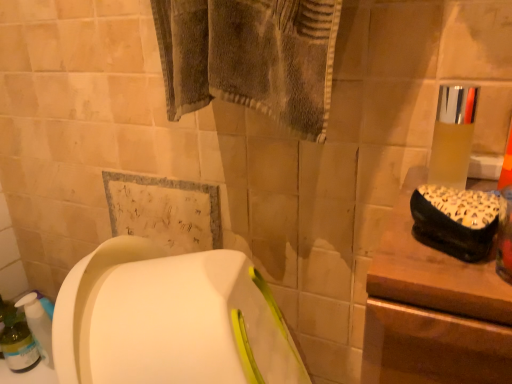
Find the location of a particular element. translucent plastic cup at upper right is located at coordinates (453, 135).

The image size is (512, 384). Describe the element at coordinates (453, 135) in the screenshot. I see `translucent plastic cup at upper right` at that location.

The width and height of the screenshot is (512, 384). I want to click on translucent plastic bottle at lower left, so click(17, 341).

The image size is (512, 384). Describe the element at coordinates (17, 341) in the screenshot. I see `translucent plastic bottle at lower left` at that location.

Identify the location of translucent plastic cup at upper right. This screenshot has height=384, width=512. (453, 135).

Which is more to the right, translucent plastic cup at upper right or translucent plastic bottle at lower left?

translucent plastic cup at upper right.

Which is behind, translucent plastic cup at upper right or translucent plastic bottle at lower left?

translucent plastic bottle at lower left is further from the camera.

Does point (440, 183) lie in front of point (18, 341)?

That is True.

From the image's perspective, does translucent plastic cup at upper right appear lower than translucent plastic bottle at lower left?

No.

From a real-world perspective, which is physically below, translucent plastic cup at upper right or translucent plastic bottle at lower left?

In real-world perspective, translucent plastic bottle at lower left is lower.

Between translucent plastic cup at upper right and translucent plastic bottle at lower left, which one has larger width?

translucent plastic bottle at lower left.

Between translucent plastic cup at upper right and translucent plastic bottle at lower left, which one has more height?

Standing taller between the two is translucent plastic bottle at lower left.

Considering the relative sizes of translucent plastic cup at upper right and translucent plastic bottle at lower left in the image provided, is translucent plastic cup at upper right bigger than translucent plastic bottle at lower left?

Incorrect, translucent plastic cup at upper right is not larger than translucent plastic bottle at lower left.

Would you say translucent plastic cup at upper right is outside translucent plastic bottle at lower left?

Yes, translucent plastic cup at upper right is located beyond the bounds of translucent plastic bottle at lower left.

Is translucent plastic cup at upper right far from translucent plastic bottle at lower left?

translucent plastic cup at upper right is positioned a significant distance from translucent plastic bottle at lower left.

Is translucent plastic cup at upper right turned away from translucent plastic bottle at lower left?

No.

What's the angular difference between translucent plastic cup at upper right and translucent plastic bottle at lower left's facing directions?

The angular difference between translucent plastic cup at upper right and translucent plastic bottle at lower left is 6.75 degrees.

You are a GUI agent. You are given a task and a screenshot of the screen. Output one action in this format:
    pyautogui.click(x=<x>, y=<y>)
    Task: Click on the bottle that is under the translucent plastic cup at upper right (from a real-world perspective)
    The height and width of the screenshot is (384, 512).
    Given the screenshot: What is the action you would take?
    pyautogui.click(x=17, y=341)

Can you confirm if translucent plastic bottle at lower left is positioned to the left of translucent plastic cup at upper right?

Indeed, translucent plastic bottle at lower left is positioned on the left side of translucent plastic cup at upper right.

Which is behind, translucent plastic bottle at lower left or translucent plastic cup at upper right?

Positioned behind is translucent plastic bottle at lower left.

Is point (20, 329) in front of point (434, 177)?

No.

From the image's perspective, does translucent plastic bottle at lower left appear higher than translucent plastic cup at upper right?

No, from the image's perspective, translucent plastic bottle at lower left is not on top of translucent plastic cup at upper right.

From a real-world perspective, who is located lower, translucent plastic bottle at lower left or translucent plastic cup at upper right?

In real-world perspective, translucent plastic bottle at lower left is lower.

In terms of width, does translucent plastic bottle at lower left look wider or thinner when compared to translucent plastic cup at upper right?

In the image, translucent plastic bottle at lower left appears to be wider than translucent plastic cup at upper right.

Can you confirm if translucent plastic bottle at lower left is taller than translucent plastic cup at upper right?

Indeed, translucent plastic bottle at lower left has a greater height compared to translucent plastic cup at upper right.

In terms of size, does translucent plastic bottle at lower left appear bigger or smaller than translucent plastic cup at upper right?

translucent plastic bottle at lower left is bigger than translucent plastic cup at upper right.

Is translucent plastic bottle at lower left situated inside translucent plastic cup at upper right or outside?

translucent plastic bottle at lower left is not enclosed by translucent plastic cup at upper right.

Are translucent plastic bottle at lower left and translucent plastic cup at upper right located far from each other?

Yes, translucent plastic bottle at lower left is far from translucent plastic cup at upper right.

Is translucent plastic bottle at lower left turned away from translucent plastic cup at upper right?

No, translucent plastic bottle at lower left is not facing the opposite direction of translucent plastic cup at upper right.

You are a GUI agent. You are given a task and a screenshot of the screen. Output one action in this format:
    pyautogui.click(x=<x>, y=<y>)
    Task: Click on the mouthwash that appears above the translucent plastic bottle at lower left (from a real-world perspective)
    
    Given the screenshot: What is the action you would take?
    pyautogui.click(x=453, y=135)

You are a GUI agent. You are given a task and a screenshot of the screen. Output one action in this format:
    pyautogui.click(x=<x>, y=<y>)
    Task: Click on the bottle below the translucent plastic cup at upper right (from the image's perspective)
    
    Given the screenshot: What is the action you would take?
    pyautogui.click(x=17, y=341)

Identify the location of bottle lying on the left of translucent plastic cup at upper right. Image resolution: width=512 pixels, height=384 pixels. (17, 341).